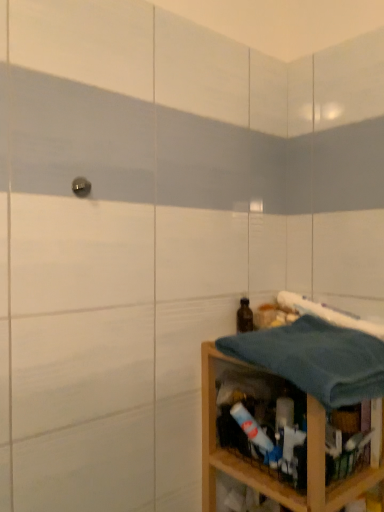
Question: Does wooden shelf at lower right lie in front of blue cotton towel at lower right, the first bath towel from the bottom?

Choices:
 (A) no
 (B) yes

Answer: (A)

Question: Considering the relative sizes of wooden shelf at lower right and blue cotton towel at lower right, the first bath towel from the bottom, in the image provided, is wooden shelf at lower right shorter than blue cotton towel at lower right, the first bath towel from the bottom,?

Choices:
 (A) yes
 (B) no

Answer: (B)

Question: Can you confirm if wooden shelf at lower right is wider than blue cotton towel at lower right, the first bath towel from the bottom?

Choices:
 (A) no
 (B) yes

Answer: (A)

Question: Is wooden shelf at lower right positioned far away from blue cotton towel at lower right, the first bath towel from the bottom?

Choices:
 (A) yes
 (B) no

Answer: (B)

Question: From a real-world perspective, does wooden shelf at lower right stand above blue cotton towel at lower right, the first bath towel from the bottom?

Choices:
 (A) no
 (B) yes

Answer: (A)

Question: Is wooden shelf at lower right next to blue cotton towel at lower right, acting as the 2th bath towel starting from the top, and touching it?

Choices:
 (A) yes
 (B) no

Answer: (B)

Question: Considering the relative sizes of blue cotton towel at lower right, acting as the 2th bath towel starting from the top, and blue waffle weave bath towel at right, which is the second bath towel from bottom to top, in the image provided, is blue cotton towel at lower right, acting as the 2th bath towel starting from the top, wider than blue waffle weave bath towel at right, which is the second bath towel from bottom to top,?

Choices:
 (A) yes
 (B) no

Answer: (A)

Question: Is blue cotton towel at lower right, acting as the 2th bath towel starting from the top, oriented away from blue waffle weave bath towel at right, arranged as the 1th bath towel when viewed from the top?

Choices:
 (A) yes
 (B) no

Answer: (B)

Question: Is blue cotton towel at lower right, acting as the 2th bath towel starting from the top, far from blue waffle weave bath towel at right, which is the second bath towel from bottom to top?

Choices:
 (A) yes
 (B) no

Answer: (B)

Question: From the image's perspective, is blue cotton towel at lower right, acting as the 2th bath towel starting from the top, on blue waffle weave bath towel at right, which is the second bath towel from bottom to top?

Choices:
 (A) no
 (B) yes

Answer: (A)

Question: Is blue cotton towel at lower right, the first bath towel from the bottom, behind blue waffle weave bath towel at right, which is the second bath towel from bottom to top?

Choices:
 (A) no
 (B) yes

Answer: (A)

Question: From a real-world perspective, is blue cotton towel at lower right, the first bath towel from the bottom, located beneath blue waffle weave bath towel at right, which is the second bath towel from bottom to top?

Choices:
 (A) no
 (B) yes

Answer: (B)

Question: Is brown glass bottle at lower right taller than blue waffle weave bath towel at right, arranged as the 1th bath towel when viewed from the top?

Choices:
 (A) no
 (B) yes

Answer: (B)